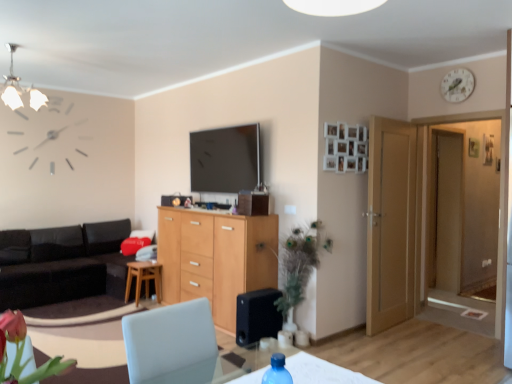
Find the location of `free space on the front side of wooden door at right`. free space on the front side of wooden door at right is located at coordinates (428, 347).